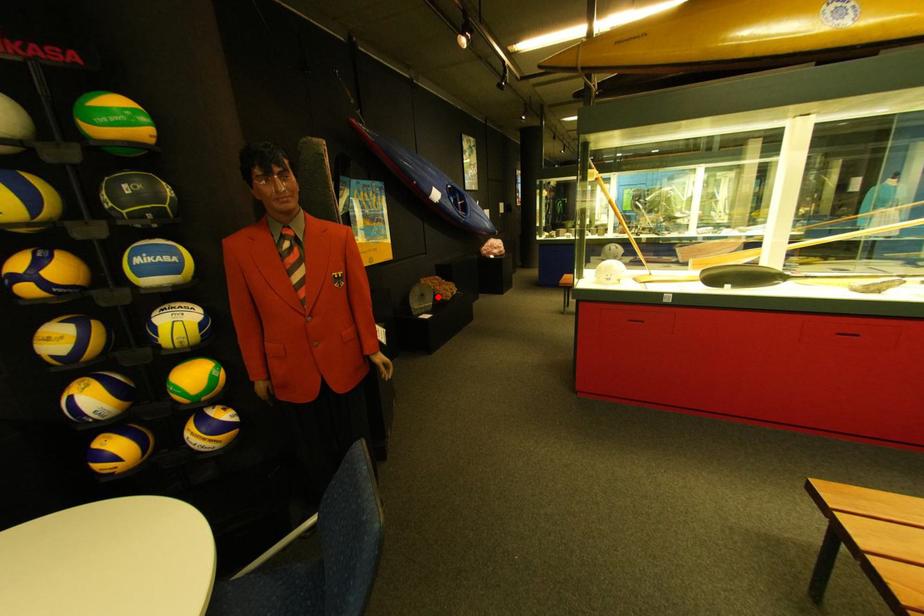
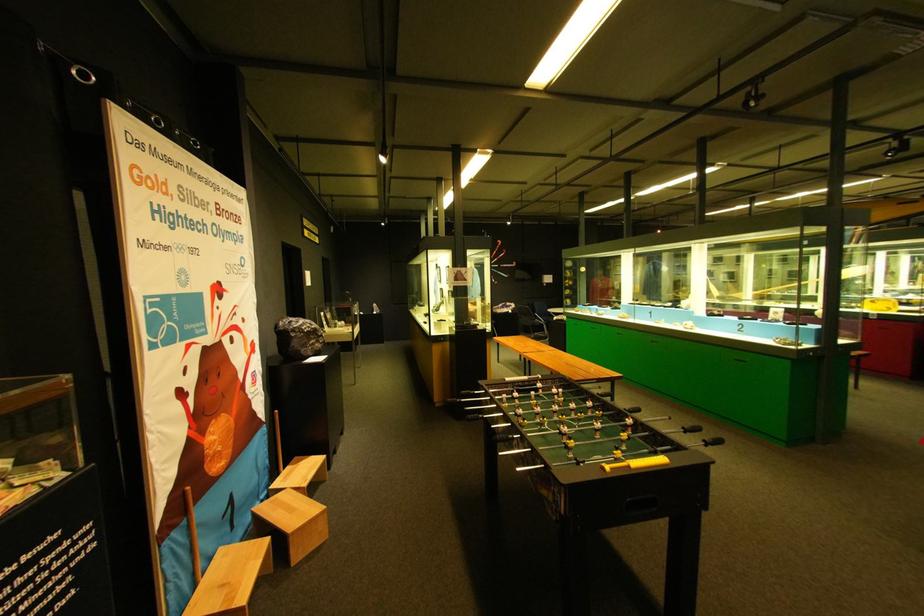
Question: I am providing you with two images of the same scene from different viewpoints. A red point is marked on the first image. Can you still see the location of the red point in image 2?

Choices:
 (A) Yes
 (B) No

Answer: (B)